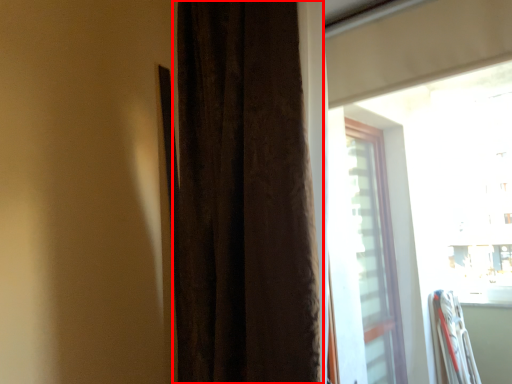
Question: From the image's perspective, what is the correct spatial relationship of curtain (annotated by the red box) in relation to window?

Choices:
 (A) above
 (B) below

Answer: (A)